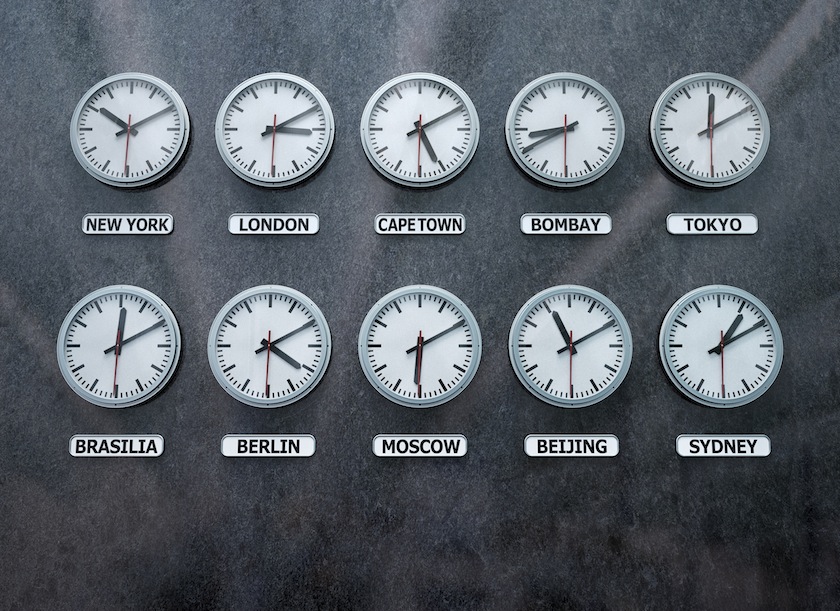
Where is `clock face`? clock face is located at coordinates (256, 125).